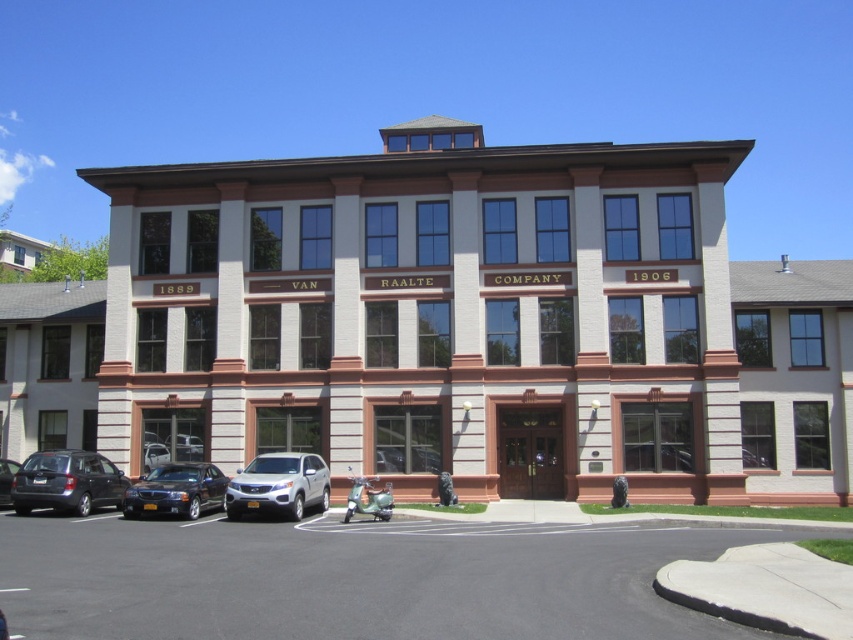
Question: Which point is closer to the camera?

Choices:
 (A) shiny black sedan at lower left
 (B) satin silver suv at lower center

Answer: (B)

Question: Does shiny black sedan at lower left have a greater width compared to matte gray car at lower left?

Choices:
 (A) yes
 (B) no

Answer: (A)

Question: Which object is positioned farthest from the matte gray hatchback at lower left?

Choices:
 (A) satin silver suv at lower center
 (B) shiny black sedan at lower left
 (C) matte gray car at lower left

Answer: (A)

Question: Considering the relative positions of satin silver suv at lower center and shiny black sedan at lower left in the image provided, where is satin silver suv at lower center located with respect to shiny black sedan at lower left?

Choices:
 (A) below
 (B) above

Answer: (B)

Question: Can you confirm if matte gray hatchback at lower left is positioned to the left of shiny black sedan at lower left?

Choices:
 (A) yes
 (B) no

Answer: (A)

Question: Which is farther from the shiny black sedan at lower left?

Choices:
 (A) matte gray car at lower left
 (B) matte gray hatchback at lower left
 (C) satin silver suv at lower center

Answer: (A)